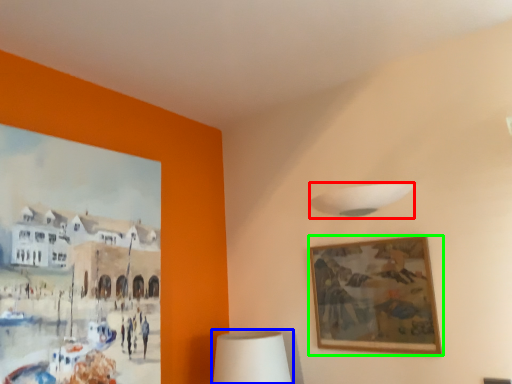
Question: Which object is positioned farthest from lamp (highlighted by a red box)? Select from table lamp (highlighted by a blue box) and picture frame (highlighted by a green box).

Choices:
 (A) table lamp
 (B) picture frame

Answer: (A)